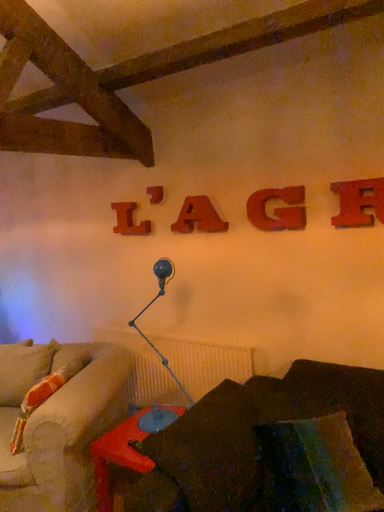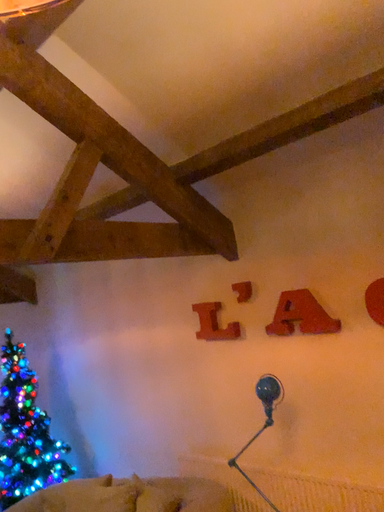
Question: Which way did the camera rotate in the video?

Choices:
 (A) rotated left
 (B) rotated right

Answer: (A)